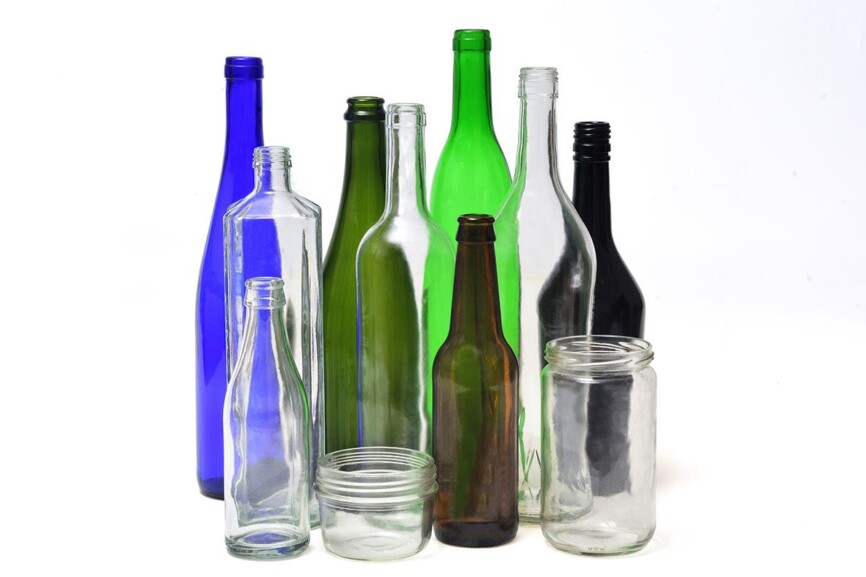
Where is `clear glass`? This screenshot has height=577, width=866. clear glass is located at coordinates (263, 234), (268, 392), (411, 234), (393, 516), (623, 443), (546, 223).